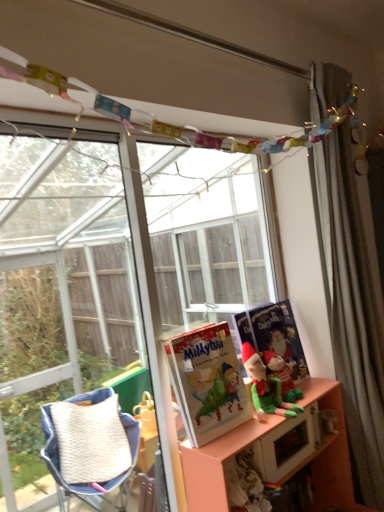
At what (x,y) coordinates should I click in order to perform the action: click on spots to the right of matte paper book at center. Please return your answer as a coordinate pair (x, y). Looking at the image, I should click on (249, 424).